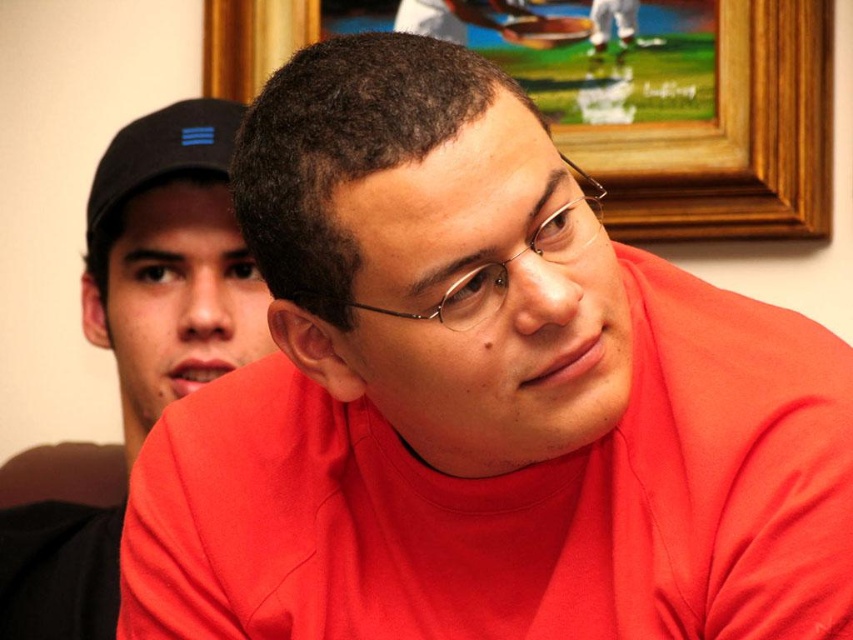
Image resolution: width=853 pixels, height=640 pixels. Find the location of `matte black cap at upper left`. matte black cap at upper left is located at coordinates (170, 259).

Between point (105, 253) and point (582, 200), which one is positioned behind?

The point (105, 253) is behind.

Who is more forward, (x=85, y=520) or (x=582, y=179)?

Point (x=85, y=520) is in front.

You are a GUI agent. You are given a task and a screenshot of the screen. Output one action in this format:
    pyautogui.click(x=<x>, y=<y>)
    Task: Click on the matte black cap at upper left
    The width and height of the screenshot is (853, 640).
    Given the screenshot: What is the action you would take?
    pyautogui.click(x=170, y=259)

Is wooden picture frame at upper center shorter than black matte baseball cap at upper left?

Incorrect, wooden picture frame at upper center's height does not fall short of black matte baseball cap at upper left's.

Does wooden picture frame at upper center lie in front of black matte baseball cap at upper left?

That is False.

Between point (695, 180) and point (236, 112), which one is positioned behind?

Positioned behind is point (695, 180).

Find the location of a particular element. wooden picture frame at upper center is located at coordinates (732, 138).

Which is in front, point (227, 132) or point (514, 256)?

Positioned in front is point (514, 256).

Measure the distance between point (x=125, y=134) and camera.

The distance of point (x=125, y=134) from camera is 4.73 feet.

The width and height of the screenshot is (853, 640). I want to click on black matte baseball cap at upper left, so click(x=161, y=154).